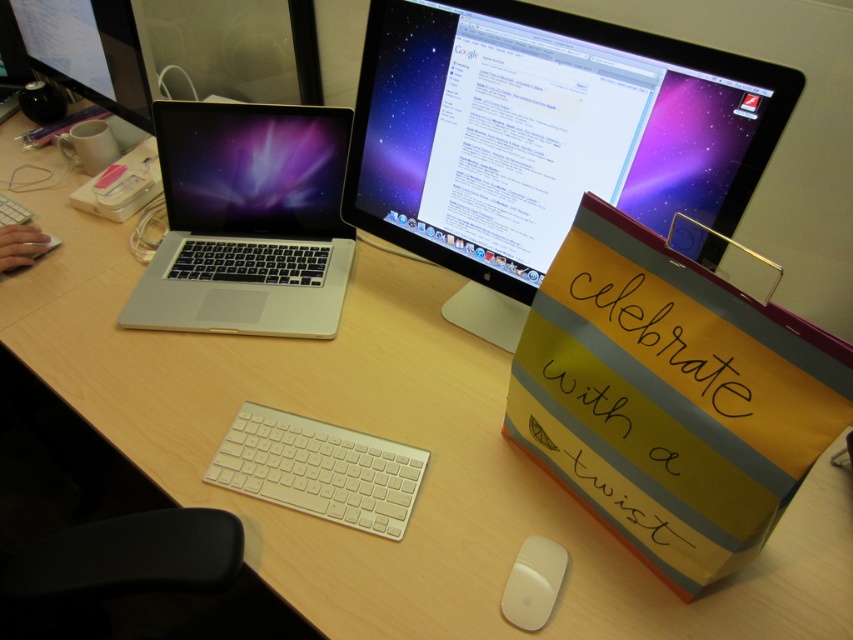
Question: Is silver metallic laptop at left below white matte mouse at lower center?

Choices:
 (A) no
 (B) yes

Answer: (A)

Question: Which point is farther to the camera?

Choices:
 (A) (595, 177)
 (B) (550, 544)
 (C) (216, 204)
 (D) (265, 449)

Answer: (C)

Question: Which object is farther from the camera taking this photo?

Choices:
 (A) matte black laptop at left
 (B) white matte mouse at lower center
 (C) white matte keyboard at center

Answer: (A)

Question: Which object is positioned closest to the silver metallic laptop at left?

Choices:
 (A) white matte keyboard at center
 (B) white matte mouse at lower center
 (C) matte black monitor at center

Answer: (C)

Question: In this image, where is white matte keyboard at center located relative to white matte mouse at lower center?

Choices:
 (A) below
 (B) above

Answer: (B)

Question: Is matte black monitor at center to the left of white matte keyboard at center from the viewer's perspective?

Choices:
 (A) no
 (B) yes

Answer: (A)